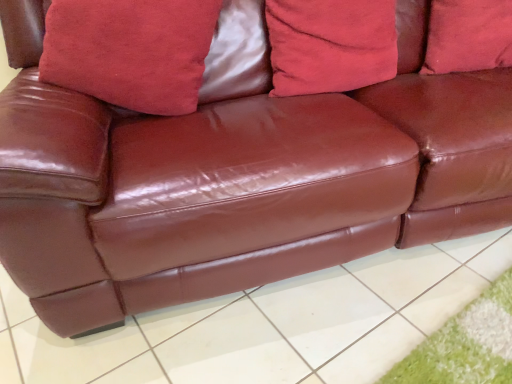
Question: Relative to velvet red pillow at center, acting as the second pillow starting from the left, is shiny brown leather couch at center in front or behind?

Choices:
 (A) behind
 (B) front

Answer: (B)

Question: Is shiny brown leather couch at center taller or shorter than velvet red pillow at center, which ranks as the second pillow in right-to-left order?

Choices:
 (A) short
 (B) tall

Answer: (A)

Question: Which is farther from the shiny brown leather couch at center?

Choices:
 (A) velvet red pillow at center, which ranks as the second pillow in right-to-left order
 (B) suede-like red pillow at upper center, the 1th pillow from the left
 (C) suede-like red pillow at upper center, which appears as the 1th pillow when viewed from the right

Answer: (C)

Question: Considering the real-world distances, which object is farthest from the velvet red pillow at center, which ranks as the second pillow in right-to-left order?

Choices:
 (A) shiny brown leather couch at center
 (B) suede-like red pillow at upper center, the 1th pillow from the left
 (C) suede-like red pillow at upper center, which appears as the 1th pillow when viewed from the right

Answer: (A)